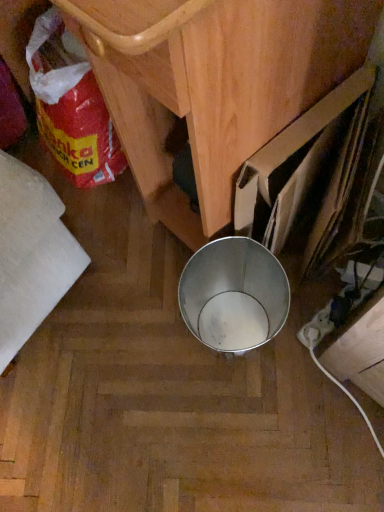
This screenshot has height=512, width=384. What do you see at coordinates (213, 84) in the screenshot?
I see `metallic bucket at center` at bounding box center [213, 84].

Identify the location of metallic bucket at center. The height and width of the screenshot is (512, 384). (213, 84).

Identify the location of red plastic bag at lower left. (71, 106).

The image size is (384, 512). Describe the element at coordinates (71, 106) in the screenshot. I see `red plastic bag at lower left` at that location.

In the scene shown: Measure the distance between red plastic bag at lower left and camera.

→ They are 94.00 centimeters apart.

Locate an element on the screen. metallic bucket at center is located at coordinates (213, 84).

Considering the relative positions of red plastic bag at lower left and metallic bucket at center in the image provided, is red plastic bag at lower left to the left of metallic bucket at center from the viewer's perspective?

Yes, red plastic bag at lower left is to the left of metallic bucket at center.

Is the depth of red plastic bag at lower left less than that of metallic bucket at center?

No, it is not.

Between point (113, 142) and point (304, 76), which one is positioned in front?

Positioned in front is point (304, 76).

From the image's perspective, which object appears higher, red plastic bag at lower left or metallic bucket at center?

metallic bucket at center appears higher in the image.

From a real-world perspective, does red plastic bag at lower left sit lower than metallic bucket at center?

Yes, from a real-world perspective, red plastic bag at lower left is beneath metallic bucket at center.

Between red plastic bag at lower left and metallic bucket at center, which one has smaller width?

red plastic bag at lower left is thinner.

Does red plastic bag at lower left have a lesser height compared to metallic bucket at center?

Correct, red plastic bag at lower left is not as tall as metallic bucket at center.

Is red plastic bag at lower left bigger or smaller than metallic bucket at center?

In the image, red plastic bag at lower left appears to be smaller than metallic bucket at center.

Is metallic bucket at center completely or partially inside red plastic bag at lower left?

No, metallic bucket at center is not inside red plastic bag at lower left.

Is red plastic bag at lower left not close to metallic bucket at center?

They are positioned close to each other.

Is red plastic bag at lower left aimed at metallic bucket at center?

Yes, red plastic bag at lower left is oriented towards metallic bucket at center.

How many degrees apart are the facing directions of red plastic bag at lower left and metallic bucket at center?

There is a 5.21-degree angle between the facing directions of red plastic bag at lower left and metallic bucket at center.

Locate an element on the screen. waste located on the left of metallic bucket at center is located at coordinates (71, 106).

Can you confirm if metallic bucket at center is positioned to the right of red plastic bag at lower left?

Indeed, metallic bucket at center is positioned on the right side of red plastic bag at lower left.

Which object is more forward, metallic bucket at center or red plastic bag at lower left?

Positioned in front is metallic bucket at center.

Does point (146, 58) come behind point (126, 167)?

No, it is not.

From the image's perspective, is metallic bucket at center on red plastic bag at lower left?

Yes, from the image's perspective, metallic bucket at center is on top of red plastic bag at lower left.

From a real-world perspective, relative to red plastic bag at lower left, is metallic bucket at center vertically above or below?

In terms of real-world spatial position, metallic bucket at center is above red plastic bag at lower left.

Is metallic bucket at center wider or thinner than red plastic bag at lower left?

metallic bucket at center is wider than red plastic bag at lower left.

Considering the relative sizes of metallic bucket at center and red plastic bag at lower left in the image provided, is metallic bucket at center taller than red plastic bag at lower left?

Yes.

Considering the relative sizes of metallic bucket at center and red plastic bag at lower left in the image provided, is metallic bucket at center bigger than red plastic bag at lower left?

Yes.

Is metallic bucket at center completely or partially outside of red plastic bag at lower left?

metallic bucket at center is positioned outside red plastic bag at lower left.

Can you see metallic bucket at center touching red plastic bag at lower left?

No, metallic bucket at center is not beside red plastic bag at lower left.

Is metallic bucket at center positioned with its back to red plastic bag at lower left?

Yes, metallic bucket at center is positioned with its back facing red plastic bag at lower left.

Can you tell me how much metallic bucket at center and red plastic bag at lower left differ in facing direction?

The angle between the facing direction of metallic bucket at center and the facing direction of red plastic bag at lower left is 5.21 degrees.

Measure the distance between metallic bucket at center and red plastic bag at lower left.

A distance of 14.16 inches exists between metallic bucket at center and red plastic bag at lower left.

The width and height of the screenshot is (384, 512). Identify the location of furniture located in front of the red plastic bag at lower left. (213, 84).

Locate an element on the screen. Image resolution: width=384 pixels, height=512 pixels. furniture lying on the right of red plastic bag at lower left is located at coordinates (213, 84).

The image size is (384, 512). What are the coordinates of `waste to the left of metallic bucket at center` in the screenshot? It's located at (71, 106).